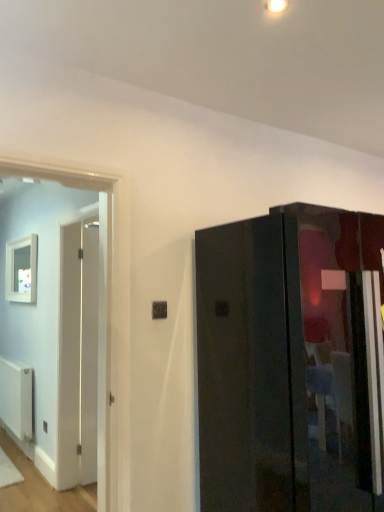
Question: Is white matte picture frame at left closer to camera compared to glossy black cabinet at right?

Choices:
 (A) yes
 (B) no

Answer: (B)

Question: Considering the relative sizes of white matte picture frame at left and glossy black cabinet at right in the image provided, is white matte picture frame at left thinner than glossy black cabinet at right?

Choices:
 (A) no
 (B) yes

Answer: (B)

Question: From a real-world perspective, does white matte picture frame at left stand above glossy black cabinet at right?

Choices:
 (A) no
 (B) yes

Answer: (B)

Question: Considering the relative sizes of white matte picture frame at left and glossy black cabinet at right in the image provided, is white matte picture frame at left wider than glossy black cabinet at right?

Choices:
 (A) no
 (B) yes

Answer: (A)

Question: Does white matte picture frame at left turn towards glossy black cabinet at right?

Choices:
 (A) yes
 (B) no

Answer: (B)

Question: Based on their sizes in the image, would you say white matte picture frame at left is bigger or smaller than black plastic electric outlet at center?

Choices:
 (A) small
 (B) big

Answer: (B)

Question: In terms of width, does white matte picture frame at left look wider or thinner when compared to black plastic electric outlet at center?

Choices:
 (A) thin
 (B) wide

Answer: (B)

Question: Does point click(x=33, y=245) appear closer or farther from the camera than point click(x=160, y=303)?

Choices:
 (A) farther
 (B) closer

Answer: (A)

Question: Would you say white matte picture frame at left is to the left or to the right of black plastic electric outlet at center in the picture?

Choices:
 (A) left
 (B) right

Answer: (A)

Question: In terms of height, does glossy black cabinet at right look taller or shorter compared to white matte radiator at lower left?

Choices:
 (A) short
 (B) tall

Answer: (B)

Question: From a real-world perspective, is glossy black cabinet at right physically located above or below white matte radiator at lower left?

Choices:
 (A) below
 (B) above

Answer: (B)

Question: In terms of size, does glossy black cabinet at right appear bigger or smaller than white matte radiator at lower left?

Choices:
 (A) small
 (B) big

Answer: (B)

Question: Which is correct: glossy black cabinet at right is inside white matte radiator at lower left, or outside of it?

Choices:
 (A) inside
 (B) outside

Answer: (B)

Question: From a real-world perspective, is black plastic electric outlet at center physically located above or below white matte picture frame at left?

Choices:
 (A) above
 (B) below

Answer: (B)

Question: In terms of height, does black plastic electric outlet at center look taller or shorter compared to white matte picture frame at left?

Choices:
 (A) short
 (B) tall

Answer: (A)